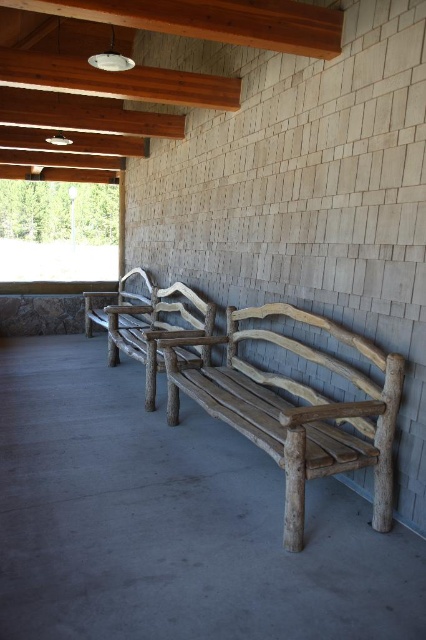
You are sitting on the natural wood bench at center and want to move to the weathered wood bench at center. Which direction should you face to walk towards it?

You should face to the right to walk towards the weathered wood bench at center, since it is located to the right of the natural wood bench at center.

You are standing at the entrance of the pavilion and want to sit on the natural wood bench at center. Based on the coordinates provided, which direction should you walk to reach it?

The natural wood bench at center is located at coordinates point (155, 328). Since the Y coordinate is 0.366, which is lower than 0.5, the center point of the image, you should walk forward towards the lower part of the image to reach it.